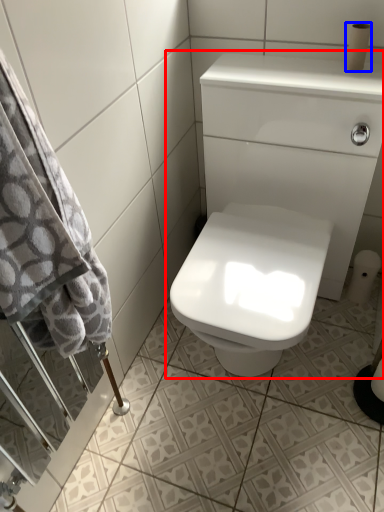
Question: Which object is further to the camera taking this photo, sink (highlighted by a red box) or toilet paper (highlighted by a blue box)?

Choices:
 (A) sink
 (B) toilet paper

Answer: (B)